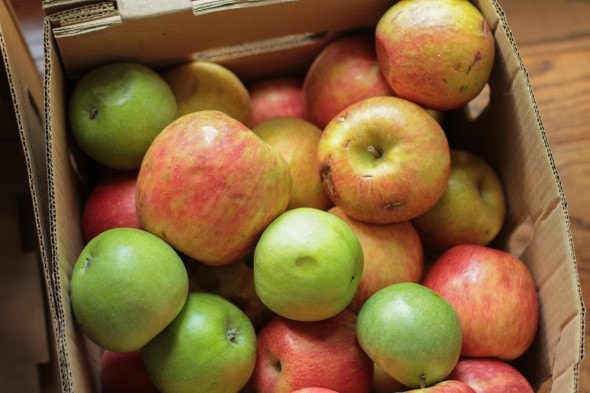
Image resolution: width=590 pixels, height=393 pixels. In order to click on box in this screenshot , I will do `click(513, 199)`.